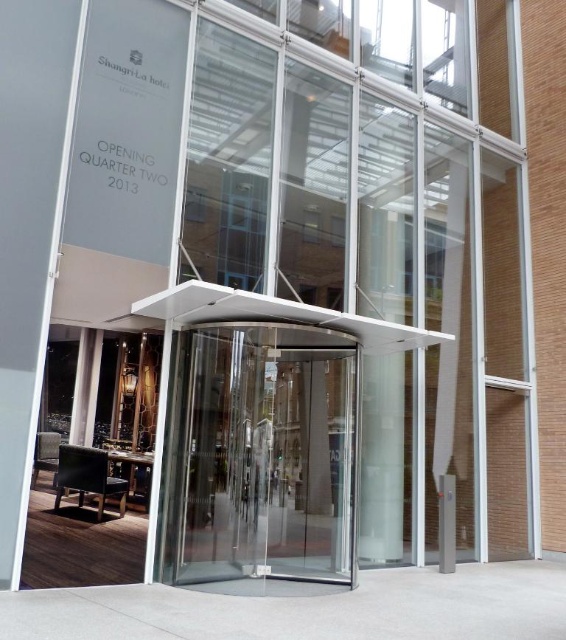
You are a delivery person trying to enter the Shangri La hotel. You see the transparent glass door at center and the smooth concrete pillar at center. Which one is bigger in size?

The transparent glass door at center is larger in size than the smooth concrete pillar at center.

You are standing at the entrance of the Shangri La hotel and want to enter. You see a transparent glass door at center and a smooth concrete pillar at center. Which object is closer to your left side?

The transparent glass door at center is to the left of the smooth concrete pillar at center, so it is closer to your left side.